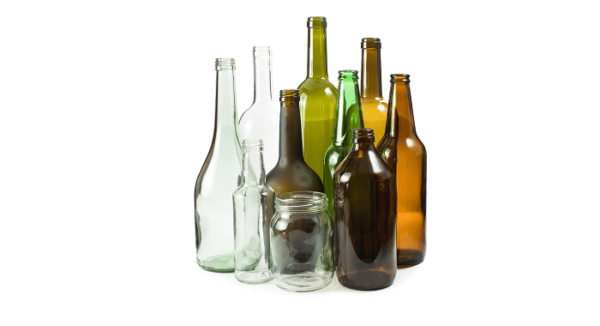
The width and height of the screenshot is (600, 326). Find the location of `glass bottles`. glass bottles is located at coordinates (215, 203), (246, 228), (262, 116), (294, 164), (315, 122), (347, 105), (357, 191), (394, 160), (377, 114).